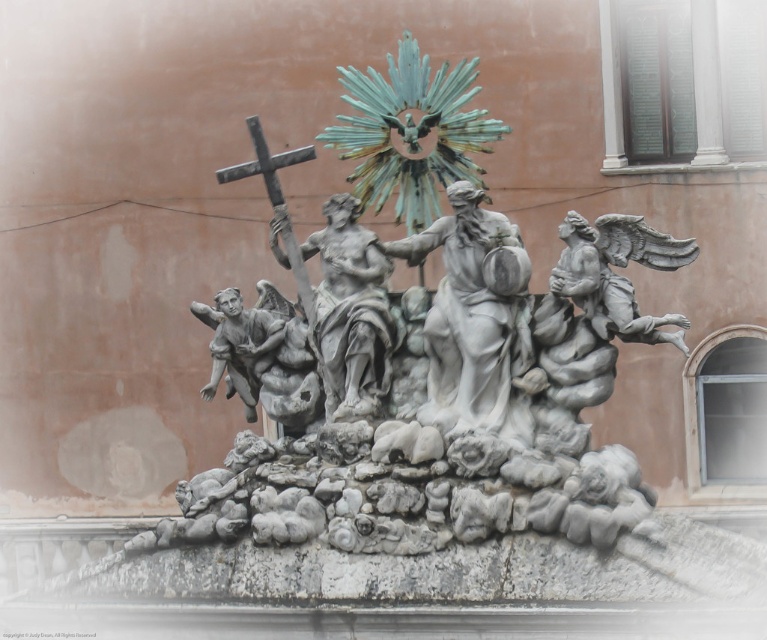
Question: Does polished bronze statue at center have a greater width compared to metallic cross at upper left?

Choices:
 (A) no
 (B) yes

Answer: (A)

Question: Among these points, which one is nearest to the camera?

Choices:
 (A) (341, 232)
 (B) (288, 156)

Answer: (B)

Question: Does polished bronze statue at center appear over metallic cross at upper left?

Choices:
 (A) yes
 (B) no

Answer: (B)

Question: Does polished bronze statue at center appear on the left side of metallic cross at upper left?

Choices:
 (A) no
 (B) yes

Answer: (A)

Question: Among these points, which one is nearest to the camera?

Choices:
 (A) (328, 365)
 (B) (272, 182)

Answer: (A)